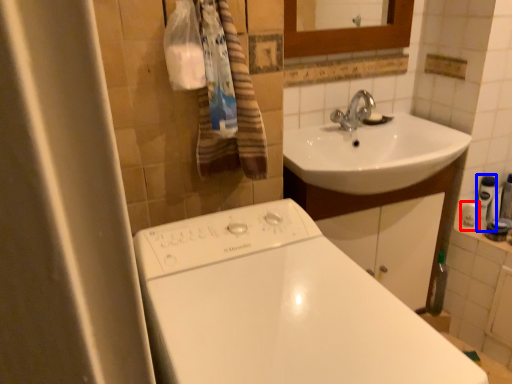
Question: Which of the following is the closest to the observer, toiletry (highlighted by a red box) or toiletry (highlighted by a blue box)?

Choices:
 (A) toiletry
 (B) toiletry

Answer: (B)